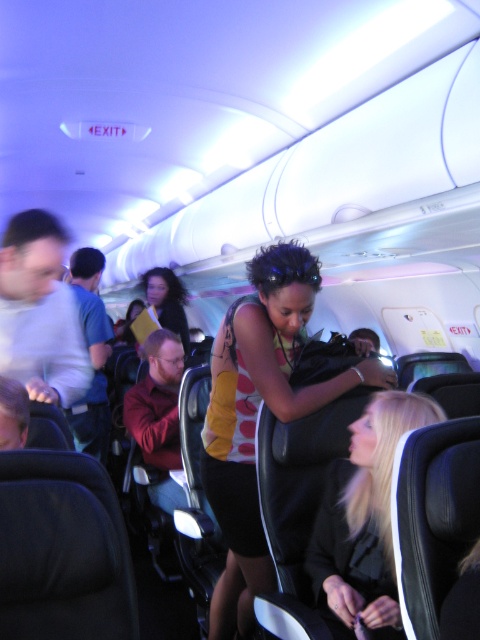
You are a flight attendant on an airplane and need to locate two jackets. The black leather jacket at lower right and the matte yellow jacket at center are both visible. Which jacket is positioned more to the right side of the scene?

The black leather jacket at lower right is positioned more to the right side of the scene because it is to the right of the matte yellow jacket at center.

You are seated in the airplane cabin and notice two items near you. The yellow sleeveless top at center and the black leather jacket at lower right. Which item is positioned higher in the image?

The yellow sleeveless top at center is positioned higher than the black leather jacket at lower right.